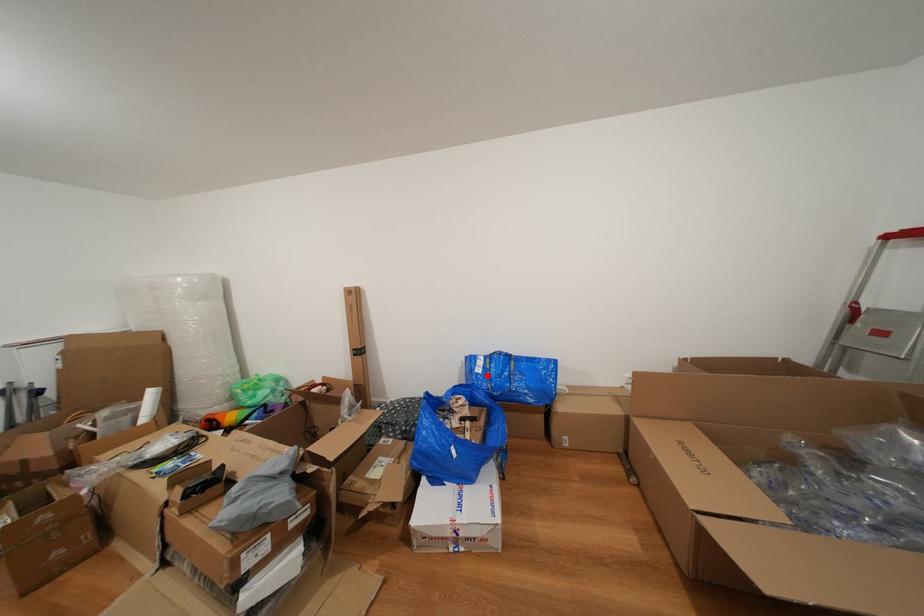
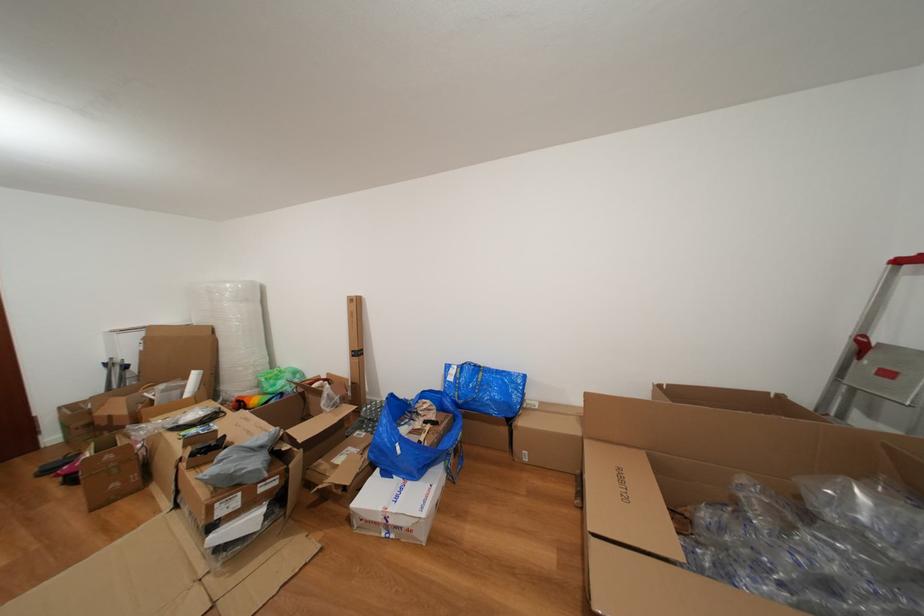
Question: I am providing you with two images of the same scene from different viewpoints. A red point is marked on the first image. Can you still see the location of the red point in image 2?

Choices:
 (A) Yes
 (B) No

Answer: (A)